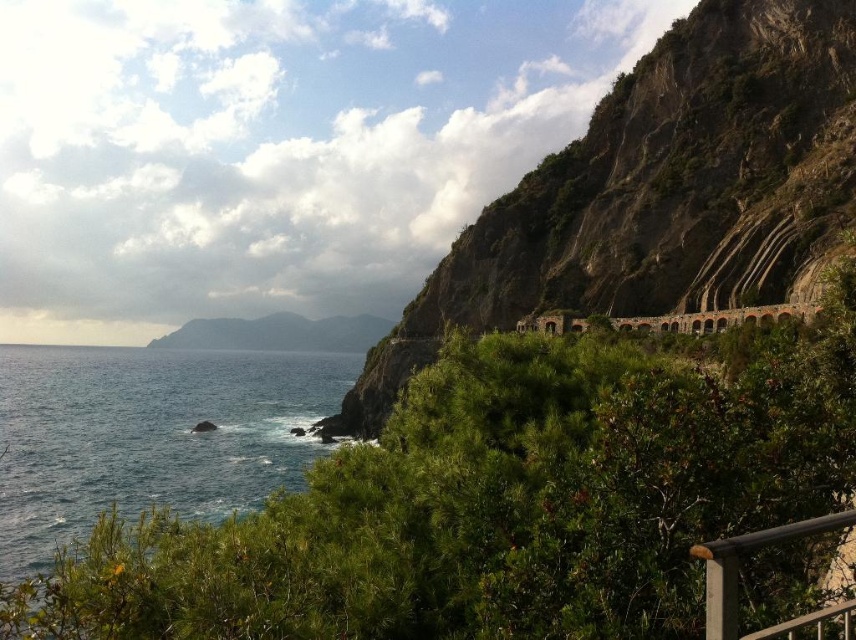
Which of these two, rugged stone cliff at right or blue liquid water at lower left, stands shorter?

blue liquid water at lower left is shorter.

Which is below, rugged stone cliff at right or blue liquid water at lower left?

blue liquid water at lower left is below.

Is point (805, 205) closer to camera compared to point (272, 380)?

Yes, point (805, 205) is in front of point (272, 380).

Locate an element on the screen. rugged stone cliff at right is located at coordinates (657, 192).

Is rugged stone cliff at right bigger than silver metallic balustrade at lower right?

Yes, rugged stone cliff at right is bigger than silver metallic balustrade at lower right.

Does rugged stone cliff at right have a lesser width compared to silver metallic balustrade at lower right?

No.

Locate an element on the screen. Image resolution: width=856 pixels, height=640 pixels. rugged stone cliff at right is located at coordinates (657, 192).

Who is positioned more to the left, blue liquid water at lower left or silver metallic balustrade at lower right?

blue liquid water at lower left is more to the left.

Is point (100, 458) more distant than point (805, 616)?

Yes, it is behind point (805, 616).

Which is behind, point (28, 480) or point (730, 609)?

Positioned behind is point (28, 480).

Find the location of a particular element. blue liquid water at lower left is located at coordinates (147, 433).